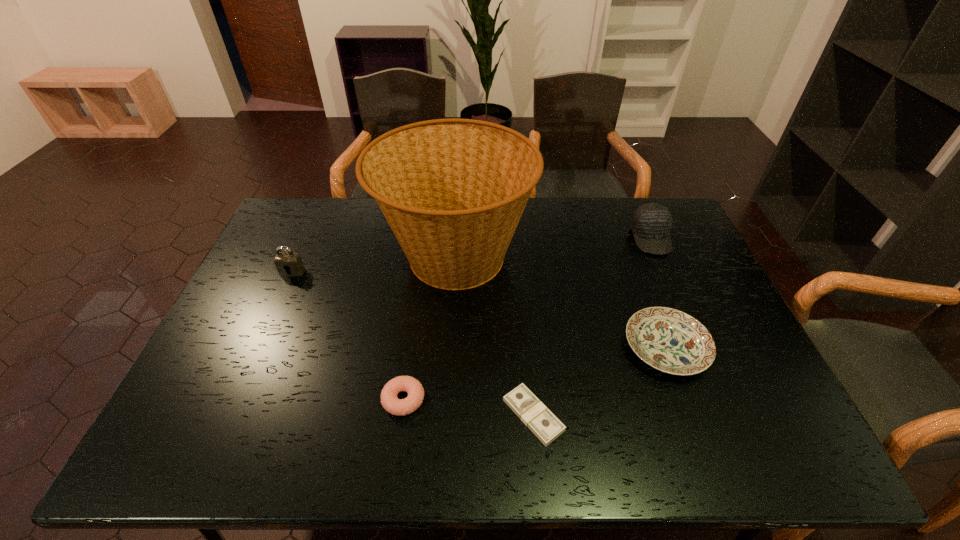
Identify the location of free space at the near edge of the desktop. tap(572, 443).

Image resolution: width=960 pixels, height=540 pixels. In the image, there is a desktop. Identify the location of vacant space at the left edge. (280, 276).

You are a GUI agent. You are given a task and a screenshot of the screen. Output one action in this format:
    pyautogui.click(x=<x>, y=<y>)
    Task: Click on the vacant space at the right edge of the desktop
    
    Given the screenshot: What is the action you would take?
    pyautogui.click(x=722, y=326)

Locate an element on the screen. vacant area at the far left corner of the desktop is located at coordinates (285, 218).

Identify the location of free area in between the shortest object and the baseball cap. (592, 327).

Find the location of a particular element. unoccupied position between the tallest object and the doughnut is located at coordinates (429, 329).

Image resolution: width=960 pixels, height=540 pixels. Find the location of `free space between the plate and the doughnut`. free space between the plate and the doughnut is located at coordinates (535, 374).

At what (x,y) coordinates should I click in order to perform the action: click on unoccupied position between the plate and the padlock. Please return your answer as a coordinate pair (x, y). Image resolution: width=960 pixels, height=540 pixels. Looking at the image, I should click on (479, 310).

Image resolution: width=960 pixels, height=540 pixels. I want to click on free space that is in between the shortest object and the plate, so click(600, 381).

The image size is (960, 540). Find the location of `unoccupied position between the plate and the baseball cap`. unoccupied position between the plate and the baseball cap is located at coordinates (659, 293).